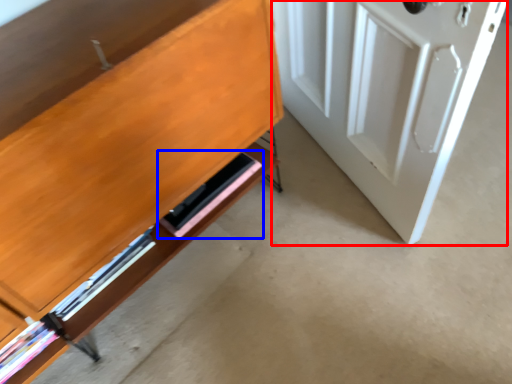
Question: Which point is further to the camera, door (highlighted by a red box) or shelf (highlighted by a blue box)?

Choices:
 (A) door
 (B) shelf

Answer: (B)